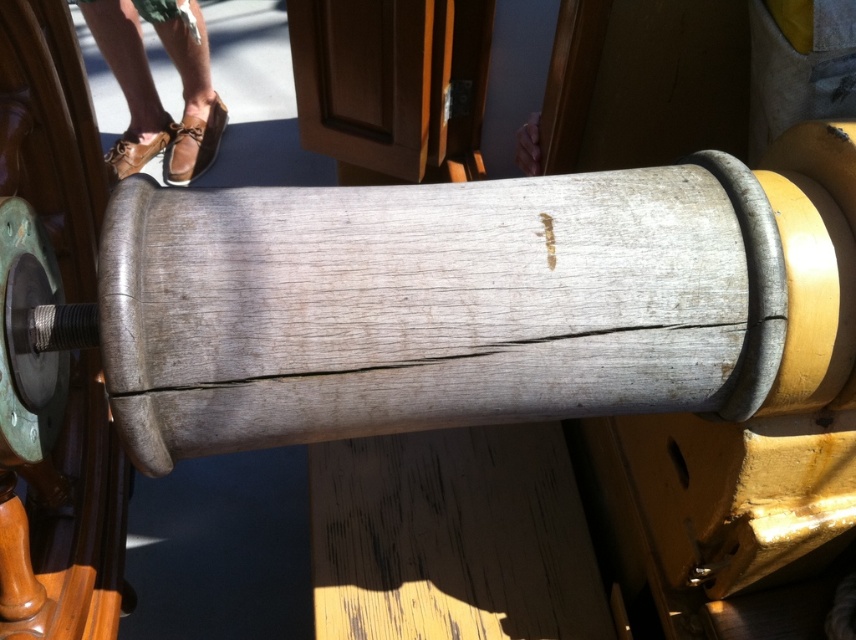
You are a sailor standing in front of the wooden cannon barrel. You notice two points marked on the structure. Which point, point (79, 634) or point (182, 131), is closer to you?

Point (79, 634) is closer to you because it is in front of point (182, 131).

You are a historian examining a historical cannon. You notice a point marked at coordinates (51, 134). What material is present at this point?

The point at (51, 134) corresponds to the green patina metal, which is part of the cannon barrel reinforcement or attachment points.

From the picture: You are standing in front of the wooden cannon barrel and notice two items nearby. One is the green patina metal at left and the other is the brown leather shoes at upper left. Which item is closer to you?

The green patina metal at left is closer to you because it is in front of the brown leather shoes at upper left.